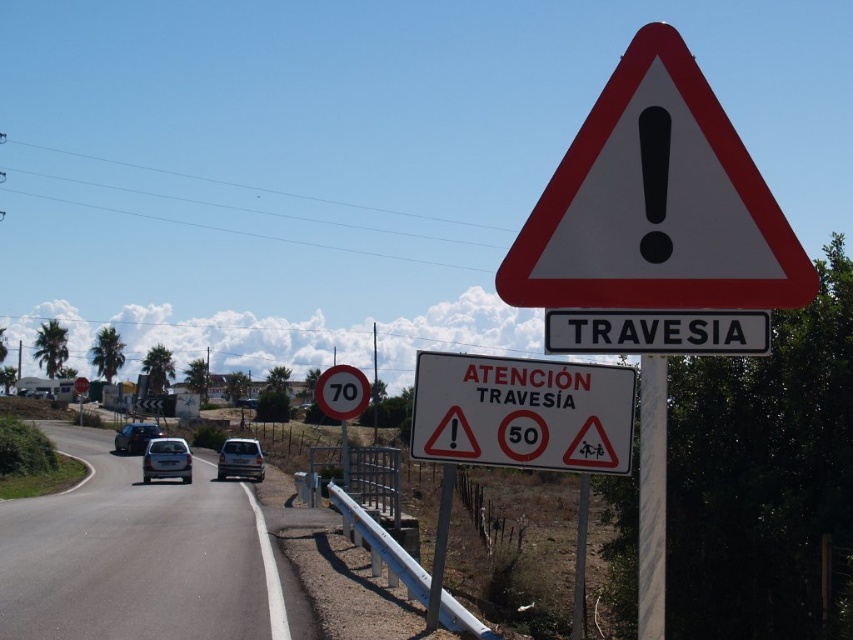
Is point (154, 557) behind point (654, 612)?

Yes, it is behind point (654, 612).

The image size is (853, 640). What are the coordinates of `asphalt road at center` in the screenshot? It's located at (142, 557).

Who is more forward, (267, 556) or (654, 570)?

Point (654, 570) is more forward.

In order to click on asphalt road at center in this screenshot , I will do `click(142, 557)`.

Does white textured pole at center appear on the right side of satin black car at center?

Indeed, white textured pole at center is positioned on the right side of satin black car at center.

The height and width of the screenshot is (640, 853). Find the location of `white textured pole at center`. white textured pole at center is located at coordinates (651, 497).

This screenshot has width=853, height=640. In order to click on white plastic sign at upper center in this screenshot , I will do `click(656, 332)`.

Does point (714, 353) lie in front of point (582, 540)?

Yes, it is in front of point (582, 540).

Find the location of a particular element. white plastic sign at upper center is located at coordinates (656, 332).